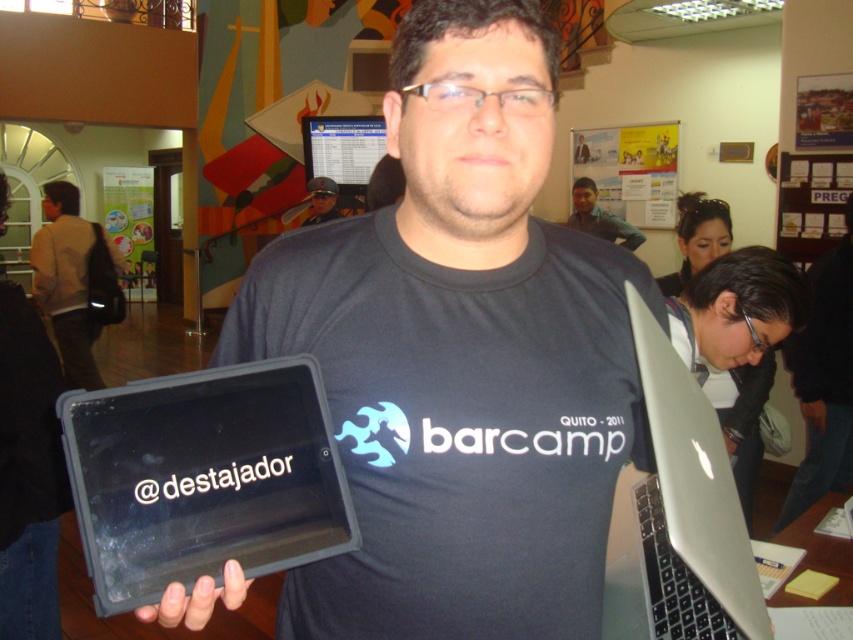
Question: Is silver metallic laptop at lower right below brown leather backpack at left?

Choices:
 (A) no
 (B) yes

Answer: (B)

Question: Which point is closer to the camera?

Choices:
 (A) matte black laptop at upper center
 (B) black matte laptop at center
 (C) black matte tablet at left

Answer: (C)

Question: Which of the following is the closest to the observer?

Choices:
 (A) brown leather backpack at left
 (B) silver metallic laptop at lower right
 (C) black matte tablet at left
 (D) black matte laptop at center

Answer: (B)

Question: Can you confirm if black plastic tablet at center is thinner than brown leather backpack at left?

Choices:
 (A) no
 (B) yes

Answer: (B)

Question: Which object appears farthest from the camera in this image?

Choices:
 (A) black matte laptop at center
 (B) black matte tablet at left
 (C) matte black tablet at center
 (D) white paper poster at upper center

Answer: (D)

Question: Does black matte laptop at center lie in front of white paper poster at upper center?

Choices:
 (A) yes
 (B) no

Answer: (A)